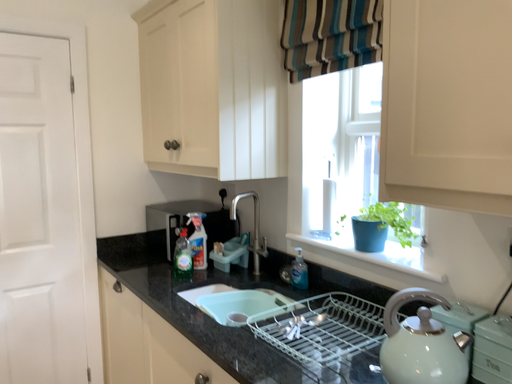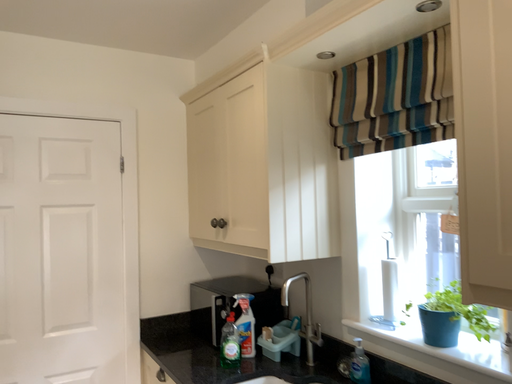
Question: Which way did the camera rotate in the video?

Choices:
 (A) rotated downward
 (B) rotated upward

Answer: (B)